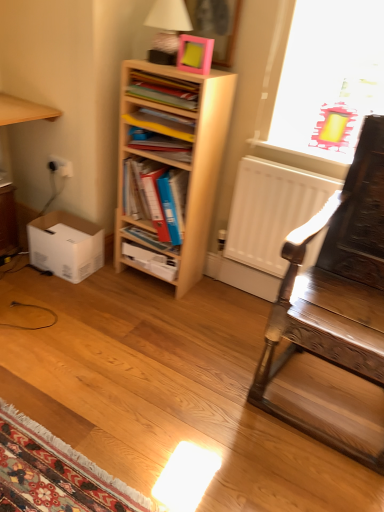
Identify the location of vacant area that lies between dark brown polished wood chair at right and white cardboard box at lower left. (178, 322).